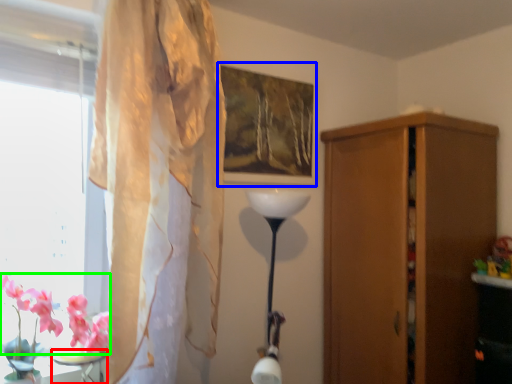
Question: Estimate the real-world distances between objects in this image. Which object is closer to table (highlighted by a red box), picture frame (highlighted by a blue box) or flower (highlighted by a green box)?

Choices:
 (A) picture frame
 (B) flower

Answer: (B)